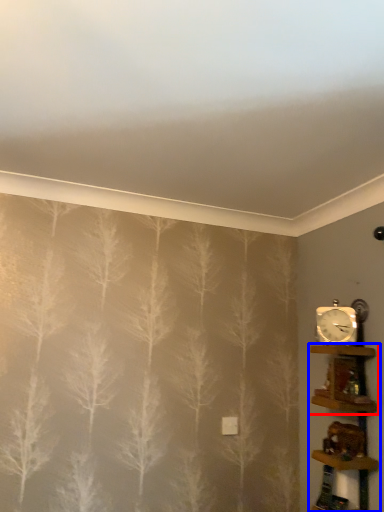
Question: Among these objects, which one is farthest to the camera, shelf (highlighted by a red box) or shelf (highlighted by a blue box)?

Choices:
 (A) shelf
 (B) shelf

Answer: (A)